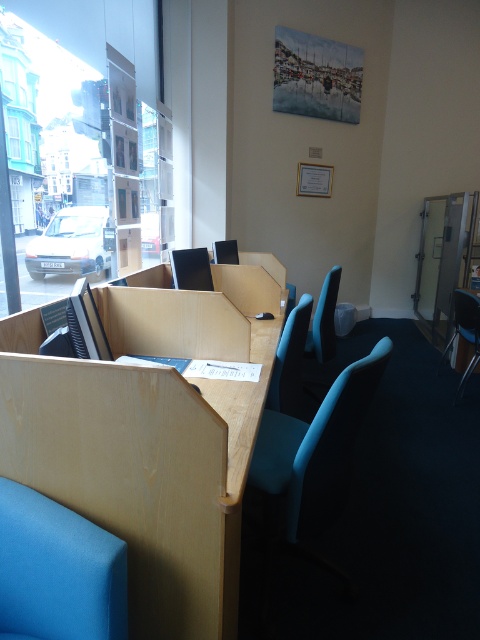
Question: Is light wood table at center to the right of teal fabric chair at center from the viewer's perspective?

Choices:
 (A) yes
 (B) no

Answer: (B)

Question: Which point is closer to the camera?

Choices:
 (A) blue fabric chair at center
 (B) matte black chair at right

Answer: (A)

Question: Is blue fabric chair at center bigger than matte black chair at right?

Choices:
 (A) no
 (B) yes

Answer: (A)

Question: Can you confirm if light wood table at center is positioned below matte cardboard box at center?

Choices:
 (A) yes
 (B) no

Answer: (A)

Question: Which of the following is the farthest from the observer?

Choices:
 (A) (468, 376)
 (B) (278, 353)
 (C) (337, 275)

Answer: (A)

Question: Which point is farther to the camera?

Choices:
 (A) matte blue chair at center
 (B) matte cardboard box at center

Answer: (B)